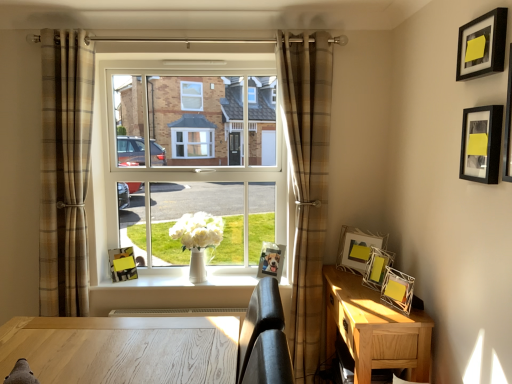
What do you see at coordinates (357, 249) in the screenshot? I see `white wire picture frame at right, the 3th picture frame viewed from the left` at bounding box center [357, 249].

The width and height of the screenshot is (512, 384). Describe the element at coordinates (481, 144) in the screenshot. I see `black matte picture frame at upper right, the sixth picture frame viewed from the left` at that location.

The height and width of the screenshot is (384, 512). What do you see at coordinates (187, 278) in the screenshot?
I see `white glossy vase at center` at bounding box center [187, 278].

What are the coordinates of `light brown wood nightstand at lower right` in the screenshot? It's located at (375, 329).

Is white glossy vase at center positioned in front of black matte picture frame at upper right, which is counted as the 5th picture frame, starting from the left?

That is False.

Can you see white glossy vase at center touching black matte picture frame at upper right, which is the 2th picture frame in right-to-left order?

white glossy vase at center is not next to black matte picture frame at upper right, which is the 2th picture frame in right-to-left order, and they're not touching.

Could you tell me if white glossy vase at center is turned towards black matte picture frame at upper right, which is counted as the sixth picture frame, starting from the back?

No, white glossy vase at center is not turned towards black matte picture frame at upper right, which is counted as the sixth picture frame, starting from the back.

Is white glossy vase at center situated inside black matte picture frame at upper right, which is the 2th picture frame in right-to-left order, or outside?

The correct answer is: outside.

Based on the photo, does metallic silver photo frame at center, the 2th picture frame from the back, appear on the right side of white wire picture frame at right, the third picture frame viewed from the back?

Incorrect, metallic silver photo frame at center, the 2th picture frame from the back, is not on the right side of white wire picture frame at right, the third picture frame viewed from the back.

Does metallic silver photo frame at center, the 2th picture frame from the back, have a larger size compared to white wire picture frame at right, the third picture frame viewed from the back?

No, metallic silver photo frame at center, the 2th picture frame from the back, is not bigger than white wire picture frame at right, the third picture frame viewed from the back.

Could you tell me if metallic silver photo frame at center, placed as the second picture frame when sorted from left to right, is turned towards white wire picture frame at right, the 3th picture frame viewed from the left?

No, metallic silver photo frame at center, placed as the second picture frame when sorted from left to right, is not oriented towards white wire picture frame at right, the 3th picture frame viewed from the left.

Which of these two, plaid fabric curtain at left, the 2th curtain from the right, or brown plaid curtain at center, placed as the second curtain when sorted from left to right, stands shorter?

Standing shorter between the two is plaid fabric curtain at left, the 2th curtain from the right.

Looking at this image, is plaid fabric curtain at left, the 2th curtain from the right, in front of brown plaid curtain at center, placed as the second curtain when sorted from left to right?

Yes, the depth of plaid fabric curtain at left, the 2th curtain from the right, is less than that of brown plaid curtain at center, placed as the second curtain when sorted from left to right.

Where is `curtain on the right side of plaid fabric curtain at left, the 2th curtain from the right`? curtain on the right side of plaid fabric curtain at left, the 2th curtain from the right is located at coordinates (307, 187).

Is clear glass window at center far from plaid fabric curtain at left, the 2th curtain from the right?

Actually, clear glass window at center and plaid fabric curtain at left, the 2th curtain from the right, are a little close together.

Which object is thinner, clear glass window at center or plaid fabric curtain at left, acting as the first curtain starting from the left?

clear glass window at center is thinner.

This screenshot has width=512, height=384. What are the coordinates of `the 1st curtain directly beneath the clear glass window at center (from a real-world perspective)` in the screenshot? It's located at (65, 171).

Considering the relative sizes of clear glass window at center and plaid fabric curtain at left, the 2th curtain from the right, in the image provided, is clear glass window at center bigger than plaid fabric curtain at left, the 2th curtain from the right,?

Yes, clear glass window at center is bigger than plaid fabric curtain at left, the 2th curtain from the right.

Is metallic silver photo frame at center, which ranks as the fifth picture frame in front-to-back order, facing away from white glossy vase at center?

No.

Between point (267, 264) and point (166, 282), which one is positioned behind?

The point (166, 282) is farther.

Between metallic silver photo frame at center, placed as the second picture frame when sorted from left to right, and white glossy vase at center, which one appears on the left side from the viewer's perspective?

From the viewer's perspective, white glossy vase at center appears more on the left side.

In the scene shown: From a real-world perspective, between metallic silver photo frame at center, placed as the second picture frame when sorted from left to right, and white glossy vase at center, who is vertically higher?

In real-world perspective, metallic silver photo frame at center, placed as the second picture frame when sorted from left to right, is above.

How different are the orientations of brown plaid curtain at center, the 1th curtain viewed from the right, and metallic silver picture frame at right, which is the 4th picture frame in left-to-right order, in degrees?

There is a 70.2-degree angle between the facing directions of brown plaid curtain at center, the 1th curtain viewed from the right, and metallic silver picture frame at right, which is the 4th picture frame in left-to-right order.

Does brown plaid curtain at center, placed as the second curtain when sorted from left to right, contain metallic silver picture frame at right, which is the 4th picture frame in left-to-right order?

Definitely not — metallic silver picture frame at right, which is the 4th picture frame in left-to-right order, is not inside brown plaid curtain at center, placed as the second curtain when sorted from left to right.

Consider the image. Does brown plaid curtain at center, the 1th curtain viewed from the right, appear on the right side of metallic silver picture frame at right, which is the 4th picture frame in left-to-right order?

No, brown plaid curtain at center, the 1th curtain viewed from the right, is not to the right of metallic silver picture frame at right, which is the 4th picture frame in left-to-right order.

From a real-world perspective, relative to metallic silver picture frame at right, positioned as the 3th picture frame in right-to-left order, is brown plaid curtain at center, placed as the second curtain when sorted from left to right, vertically above or below?

brown plaid curtain at center, placed as the second curtain when sorted from left to right, is above metallic silver picture frame at right, positioned as the 3th picture frame in right-to-left order.

Is brown plaid curtain at center, placed as the second curtain when sorted from left to right, aimed at white wire picture frame at right, which is the 4th picture frame in front-to-back order?

No, brown plaid curtain at center, placed as the second curtain when sorted from left to right, is not aimed at white wire picture frame at right, which is the 4th picture frame in front-to-back order.

Considering the relative positions of brown plaid curtain at center, placed as the second curtain when sorted from left to right, and white wire picture frame at right, the third picture frame viewed from the back, in the image provided, is brown plaid curtain at center, placed as the second curtain when sorted from left to right, behind white wire picture frame at right, the third picture frame viewed from the back,?

Yes, it is.

How different are the orientations of brown plaid curtain at center, the 1th curtain viewed from the right, and white wire picture frame at right, the third picture frame viewed from the back, in degrees?

The angle between the facing direction of brown plaid curtain at center, the 1th curtain viewed from the right, and the facing direction of white wire picture frame at right, the third picture frame viewed from the back, is 47.7 degrees.

Between brown plaid curtain at center, placed as the second curtain when sorted from left to right, and white wire picture frame at right, the third picture frame viewed from the back, which one has less height?

With less height is white wire picture frame at right, the third picture frame viewed from the back.

What are the coordinates of `window sill on the left of black matte picture frame at upper right, which is counted as the sixth picture frame, starting from the back` in the screenshot? It's located at (187, 278).

From a real-world perspective, count 2nd picture frames downward from the white wire picture frame at right, the 3th picture frame viewed from the left, and point to it. Please provide its 2D coordinates.

[(271, 260)]

Looking at the image, which one is located further to white wire picture frame at right, the third picture frame viewed from the back, plaid fabric curtain at left, the 2th curtain from the right, or metallic silver picture frame at right, which is the 4th picture frame in left-to-right order?

plaid fabric curtain at left, the 2th curtain from the right, lies further to white wire picture frame at right, the third picture frame viewed from the back, than the other object.

Estimate the real-world distances between objects in this image. Which object is closer to black matte picture frame at upper right, which is the 2th picture frame in right-to-left order, plaid fabric curtain at left, acting as the first curtain starting from the left, or clear glass window at center?

clear glass window at center lies closer to black matte picture frame at upper right, which is the 2th picture frame in right-to-left order, than the other object.

When comparing their distances from plaid fabric curtain at left, acting as the first curtain starting from the left, does light brown wood nightstand at lower right or white glossy vase at center seem closer?

Based on the image, white glossy vase at center appears to be nearer to plaid fabric curtain at left, acting as the first curtain starting from the left.

Estimate the real-world distances between objects in this image. Which object is further from light brown wood nightstand at lower right, black matte picture frame at upper right, which is the 2th picture frame in right-to-left order, or matte yellow picture frame at center, the first picture frame from the left?

matte yellow picture frame at center, the first picture frame from the left, is positioned further to the anchor light brown wood nightstand at lower right.

When comparing their distances from white wire picture frame at right, the 3th picture frame viewed from the left, does metallic silver picture frame at right, which is the 4th picture frame in left-to-right order, or light brown wood nightstand at lower right seem closer?

metallic silver picture frame at right, which is the 4th picture frame in left-to-right order, lies closer to white wire picture frame at right, the 3th picture frame viewed from the left, than the other object.

Looking at the image, which one is located further to plaid fabric curtain at left, the 2th curtain from the right, brown plaid curtain at center, placed as the second curtain when sorted from left to right, or white glossy vase at center?

Among the two, brown plaid curtain at center, placed as the second curtain when sorted from left to right, is located further to plaid fabric curtain at left, the 2th curtain from the right.

Based on their spatial positions, is white glossy vase at center or matte yellow picture frame at center, the first picture frame from the left, further from brown plaid curtain at center, the 1th curtain viewed from the right?

matte yellow picture frame at center, the first picture frame from the left.

Based on their spatial positions, is metallic silver picture frame at right, which is the 4th picture frame in left-to-right order, or clear glass window at center closer to metallic silver photo frame at center, which ranks as the fifth picture frame in front-to-back order?

metallic silver picture frame at right, which is the 4th picture frame in left-to-right order, is closer to metallic silver photo frame at center, which ranks as the fifth picture frame in front-to-back order.

The height and width of the screenshot is (384, 512). Identify the location of window sill between plaid fabric curtain at left, acting as the first curtain starting from the left, and brown plaid curtain at center, placed as the second curtain when sorted from left to right. pos(187,278).

In order to click on picture frame between white glossy vase at center and white wire picture frame at right, which is the 4th picture frame in right-to-left order, in the horizontal direction in this screenshot , I will do `click(271, 260)`.

The image size is (512, 384). In order to click on window sill between plaid fabric curtain at left, acting as the first curtain starting from the left, and white wire picture frame at right, which is the 4th picture frame in right-to-left order, from left to right in this screenshot , I will do `click(187, 278)`.

Locate an element on the screen. window between plaid fabric curtain at left, acting as the first curtain starting from the left, and light brown wood nightstand at lower right from left to right is located at coordinates (191, 154).